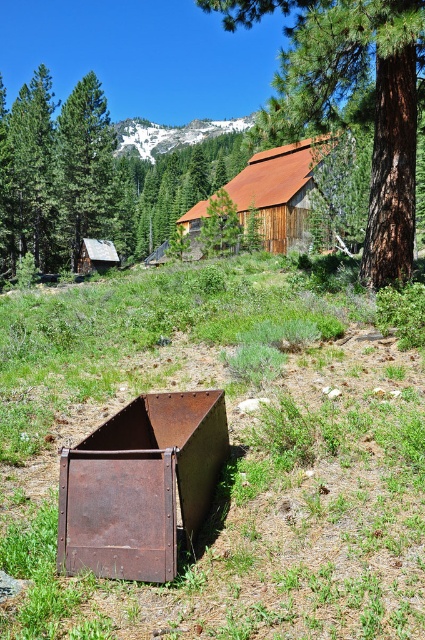
Is point (212, 433) less distant than point (82, 177)?

Yes.

Is rusty metal box at lower center behind green matte tree at upper left?

No.

Image resolution: width=425 pixels, height=640 pixels. Identify the location of rusty metal box at lower center. (139, 484).

The height and width of the screenshot is (640, 425). I want to click on rusty metal box at lower center, so click(139, 484).

Who is positioned more to the right, rusty metal container at lower left or rusty metal box at lower center?

Positioned to the right is rusty metal box at lower center.

Is rusty metal container at lower left further to camera compared to rusty metal box at lower center?

That is False.

The height and width of the screenshot is (640, 425). What do you see at coordinates (231, 456) in the screenshot?
I see `rusty metal container at lower left` at bounding box center [231, 456].

You are a GUI agent. You are given a task and a screenshot of the screen. Output one action in this format:
    pyautogui.click(x=<x>, y=<y>)
    Task: Click on the rusty metal container at lower left
    
    Given the screenshot: What is the action you would take?
    pyautogui.click(x=231, y=456)

Consider the image. Can you confirm if brown rough bark tree at upper center is positioned below green matte tree at upper left?

Indeed, brown rough bark tree at upper center is positioned under green matte tree at upper left.

Does brown rough bark tree at upper center lie in front of green matte tree at upper left?

Yes.

Between point (404, 160) and point (6, 138), which one is positioned behind?

The point (6, 138) is more distant.

You are a GUI agent. You are given a task and a screenshot of the screen. Output one action in this format:
    pyautogui.click(x=<x>, y=<y>)
    Task: Click on the brown rough bark tree at upper center
    The width and height of the screenshot is (425, 640).
    Given the screenshot: What is the action you would take?
    pyautogui.click(x=353, y=92)